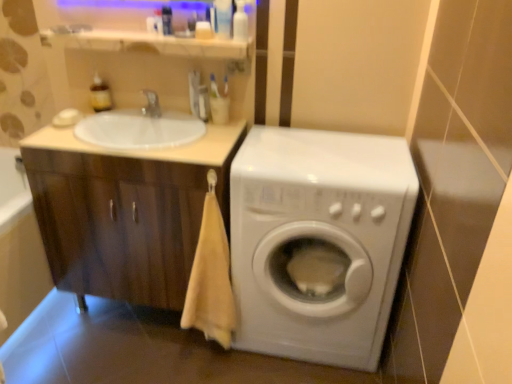
This screenshot has height=384, width=512. What do you see at coordinates (211, 279) in the screenshot?
I see `beige cotton towel at lower left` at bounding box center [211, 279].

This screenshot has width=512, height=384. Identify the location of translucent plastic toothbrush at upper center, the fourth toiletry when ordered from left to right. (203, 30).

Image resolution: width=512 pixels, height=384 pixels. Describe the element at coordinates (203, 30) in the screenshot. I see `translucent plastic toothbrush at upper center, the fourth toiletry when ordered from left to right` at that location.

This screenshot has height=384, width=512. What do you see at coordinates (223, 18) in the screenshot?
I see `translucent plastic bottle at upper center, the second toiletry positioned from the right` at bounding box center [223, 18].

Describe the element at coordinates (151, 104) in the screenshot. I see `white glossy tap at upper center` at that location.

Describe the element at coordinates (203, 103) in the screenshot. The image size is (512, 384). I see `translucent plastic toothbrush at upper center, which appears as the third toiletry when viewed from the left` at that location.

The image size is (512, 384). Describe the element at coordinates (67, 118) in the screenshot. I see `white matte soap at upper left, which is the 1th soap from bottom to top` at that location.

The image size is (512, 384). Find the location of `beige cotton towel at lower left`. beige cotton towel at lower left is located at coordinates 211,279.

Where is `the 2nd soap above the white glossy washing machine at lower right (from a real-world perspective)`? the 2nd soap above the white glossy washing machine at lower right (from a real-world perspective) is located at coordinates (68, 116).

Which is in front, white matte soap at upper left, which is the second soap in bottom-to-top order, or white glossy washing machine at lower right?

Positioned in front is white glossy washing machine at lower right.

Which object is wider, white matte soap at upper left, the first soap when ordered from top to bottom, or white glossy washing machine at lower right?

white glossy washing machine at lower right.

Can you confirm if white matte soap at upper left, which is the second soap in bottom-to-top order, is smaller than white glossy washing machine at lower right?

Yes, white matte soap at upper left, which is the second soap in bottom-to-top order, is smaller than white glossy washing machine at lower right.

From the image's perspective, starting from the wooden cabinet at lower left, which toiletry is the 2nd one above? Please provide its 2D coordinates.

[(100, 95)]

Considering the relative sizes of translucent amber bottle at upper left, which is the first toiletry from left to right, and wooden cabinet at lower left in the image provided, is translucent amber bottle at upper left, which is the first toiletry from left to right, shorter than wooden cabinet at lower left?

Indeed, translucent amber bottle at upper left, which is the first toiletry from left to right, has a lesser height compared to wooden cabinet at lower left.

Consider the image. From the image's perspective, which object appears higher, translucent amber bottle at upper left, arranged as the sixth toiletry when viewed from the right, or wooden cabinet at lower left?

translucent amber bottle at upper left, arranged as the sixth toiletry when viewed from the right, appears higher in the image.

Does translucent plastic bottle at upper center, marked as the fifth toiletry in a left-to-right arrangement, have a larger size compared to translucent amber bottle at upper left, which is the first toiletry from left to right?

Actually, translucent plastic bottle at upper center, marked as the fifth toiletry in a left-to-right arrangement, might be smaller than translucent amber bottle at upper left, which is the first toiletry from left to right.

Is translucent plastic bottle at upper center, the second toiletry positioned from the right, far from translucent amber bottle at upper left, arranged as the sixth toiletry when viewed from the right?

No.

Consider the image. Can you tell me how much translucent plastic bottle at upper center, the second toiletry positioned from the right, and translucent amber bottle at upper left, which is the first toiletry from left to right, differ in facing direction?

1.13 degrees separate the facing orientations of translucent plastic bottle at upper center, the second toiletry positioned from the right, and translucent amber bottle at upper left, which is the first toiletry from left to right.

From the image's perspective, is translucent plastic bottle at upper center, the second toiletry positioned from the right, positioned above or below translucent amber bottle at upper left, arranged as the sixth toiletry when viewed from the right?

Based on their image positions, translucent plastic bottle at upper center, the second toiletry positioned from the right, is located above translucent amber bottle at upper left, arranged as the sixth toiletry when viewed from the right.

Which of these two, white glossy sink at upper left or translucent plastic tube at upper center, positioned as the 2th toiletry in left-to-right order, is bigger?

white glossy sink at upper left.

From a real-world perspective, which object rests below the other?

white glossy sink at upper left is physically lower.

Is white glossy sink at upper left wider or thinner than translucent plastic tube at upper center, positioned as the 2th toiletry in left-to-right order?

Clearly, white glossy sink at upper left has more width compared to translucent plastic tube at upper center, positioned as the 2th toiletry in left-to-right order.

Which object is further away from the camera taking this photo, white glossy sink at upper left or translucent plastic tube at upper center, which ranks as the fifth toiletry in right-to-left order?

translucent plastic tube at upper center, which ranks as the fifth toiletry in right-to-left order.

From a real-world perspective, is translucent amber bottle at upper left, arranged as the sixth toiletry when viewed from the right, physically above translucent plastic toothbrush at upper center, which is counted as the 3th toiletry, starting from the right?

No, from a real-world perspective, translucent amber bottle at upper left, arranged as the sixth toiletry when viewed from the right, is not above translucent plastic toothbrush at upper center, which is counted as the 3th toiletry, starting from the right.

Considering the relative sizes of translucent amber bottle at upper left, which is the first toiletry from left to right, and translucent plastic toothbrush at upper center, which is counted as the 3th toiletry, starting from the right, in the image provided, is translucent amber bottle at upper left, which is the first toiletry from left to right, shorter than translucent plastic toothbrush at upper center, which is counted as the 3th toiletry, starting from the right,?

No.

Is translucent amber bottle at upper left, which is the first toiletry from left to right, beside translucent plastic toothbrush at upper center, the fourth toiletry when ordered from left to right?

They are not placed beside each other.

Can you confirm if translucent amber bottle at upper left, arranged as the sixth toiletry when viewed from the right, is positioned to the left of translucent plastic toothbrush at upper center, the fourth toiletry when ordered from left to right?

Correct, you'll find translucent amber bottle at upper left, arranged as the sixth toiletry when viewed from the right, to the left of translucent plastic toothbrush at upper center, the fourth toiletry when ordered from left to right.

Is point (70, 125) more distant than point (163, 22)?

Yes, it is.

In the image, is white matte soap at upper left, which is the 1th soap from bottom to top, on the left side or the right side of translucent plastic tube at upper center, positioned as the 2th toiletry in left-to-right order?

white matte soap at upper left, which is the 1th soap from bottom to top, is positioned on translucent plastic tube at upper center, positioned as the 2th toiletry in left-to-right order,'s left side.

Looking at this image, is white matte soap at upper left, which is the 1th soap from bottom to top, wider than translucent plastic tube at upper center, which ranks as the fifth toiletry in right-to-left order?

Correct, the width of white matte soap at upper left, which is the 1th soap from bottom to top, exceeds that of translucent plastic tube at upper center, which ranks as the fifth toiletry in right-to-left order.

From a real-world perspective, who is located lower, white matte soap at upper left, which is the 2th soap from top to bottom, or translucent plastic tube at upper center, positioned as the 2th toiletry in left-to-right order?

In real-world perspective, white matte soap at upper left, which is the 2th soap from top to bottom, is lower.

This screenshot has width=512, height=384. Find the location of `the 1st soap counting from the left of the white glossy sink at upper left`. the 1st soap counting from the left of the white glossy sink at upper left is located at coordinates (67, 118).

Can you confirm if white glossy sink at upper left is smaller than white matte soap at upper left, which is the 1th soap from bottom to top?

Actually, white glossy sink at upper left might be larger than white matte soap at upper left, which is the 1th soap from bottom to top.

Is white glossy sink at upper left behind white matte soap at upper left, which is the 1th soap from bottom to top?

No, the depth of white glossy sink at upper left is less than that of white matte soap at upper left, which is the 1th soap from bottom to top.

From the image's perspective, which is above, white glossy sink at upper left or white matte soap at upper left, which is the 1th soap from bottom to top?

white matte soap at upper left, which is the 1th soap from bottom to top, appears higher in the image.

The height and width of the screenshot is (384, 512). Identify the location of washing machine below the white matte soap at upper left, the first soap when ordered from top to bottom (from the image's perspective). (318, 240).

The height and width of the screenshot is (384, 512). What are the coordinates of `bath beneath the translucent amber bottle at upper left, which is the first toiletry from left to right (from a real-world perspective)` in the screenshot? It's located at (19, 247).

Looking at the image, which one is located closer to translucent plastic toothbrush at upper center, which is counted as the fourth toiletry, starting from the right, translucent plastic bottle at upper center, the second toiletry positioned from the right, or white matte soap at upper left, which is the 2th soap from top to bottom?

translucent plastic bottle at upper center, the second toiletry positioned from the right, lies closer to translucent plastic toothbrush at upper center, which is counted as the fourth toiletry, starting from the right, than the other object.

Considering their positions, is white matte soap at upper left, which is the second soap in bottom-to-top order, positioned further to white glossy washing machine at lower right than white matte soap at upper left, which is the 2th soap from top to bottom?

white matte soap at upper left, which is the second soap in bottom-to-top order.

Estimate the real-world distances between objects in this image. Which object is closer to wooden cabinet at left, white matte soap at upper left, which is the 2th soap from top to bottom, or white matte soap at upper left, which is the second soap in bottom-to-top order?

The object closer to wooden cabinet at left is white matte soap at upper left, which is the 2th soap from top to bottom.

Based on the photo, which object lies nearer to the anchor point beige cotton towel at lower left, white glossy tap at upper center or transparent plastic bottle at upper center, acting as the 6th toiletry starting from the left?

white glossy tap at upper center lies closer to beige cotton towel at lower left than the other object.

Considering their positions, is white glossy sink at upper left positioned closer to transparent plastic bottle at upper center, which is the first toiletry from right to left, than translucent amber bottle at upper left, arranged as the sixth toiletry when viewed from the right?

white glossy sink at upper left lies closer to transparent plastic bottle at upper center, which is the first toiletry from right to left, than the other object.

Looking at the image, which one is located closer to translucent plastic bottle at upper center, the second toiletry positioned from the right, white matte soap at upper left, which is the second soap in bottom-to-top order, or white glossy tap at upper center?

white glossy tap at upper center is closer to translucent plastic bottle at upper center, the second toiletry positioned from the right.

Looking at this image, when comparing their distances from white glossy sink at upper left, does translucent plastic tube at upper center, which ranks as the fifth toiletry in right-to-left order, or translucent plastic toothbrush at upper center, which is counted as the 3th toiletry, starting from the right, seem further?

translucent plastic tube at upper center, which ranks as the fifth toiletry in right-to-left order, is further to white glossy sink at upper left.

From the image, which object appears to be farther from translucent plastic toothbrush at upper center, which is counted as the fourth toiletry, starting from the right, white matte soap at upper left, which is the second soap in bottom-to-top order, or translucent plastic bottle at upper center, marked as the fifth toiletry in a left-to-right arrangement?

The object further to translucent plastic toothbrush at upper center, which is counted as the fourth toiletry, starting from the right, is white matte soap at upper left, which is the second soap in bottom-to-top order.

You are a GUI agent. You are given a task and a screenshot of the screen. Output one action in this format:
    pyautogui.click(x=<x>, y=<y>)
    Task: Click on the toiletry between wooden cabinet at lower left and translucent plastic tube at upper center, positioned as the 2th toiletry in left-to-right order, in the horizontal direction
    
    Given the screenshot: What is the action you would take?
    pyautogui.click(x=100, y=95)

Where is `counter top between transparent plastic bottle at upper center, acting as the 6th toiletry starting from the left, and beige cotton towel at lower left vertically`? The height and width of the screenshot is (384, 512). counter top between transparent plastic bottle at upper center, acting as the 6th toiletry starting from the left, and beige cotton towel at lower left vertically is located at coordinates (147, 149).

You are a GUI agent. You are given a task and a screenshot of the screen. Output one action in this format:
    pyautogui.click(x=<x>, y=<y>)
    Task: Click on the counter top that lies between white glossy tap at upper center and wooden cabinet at left from top to bottom
    The height and width of the screenshot is (384, 512).
    Given the screenshot: What is the action you would take?
    pyautogui.click(x=147, y=149)

This screenshot has width=512, height=384. What are the coordinates of `tap between translucent plastic bottle at upper center, marked as the fifth toiletry in a left-to-right arrangement, and white glossy washing machine at lower right from top to bottom` in the screenshot? It's located at (151, 104).